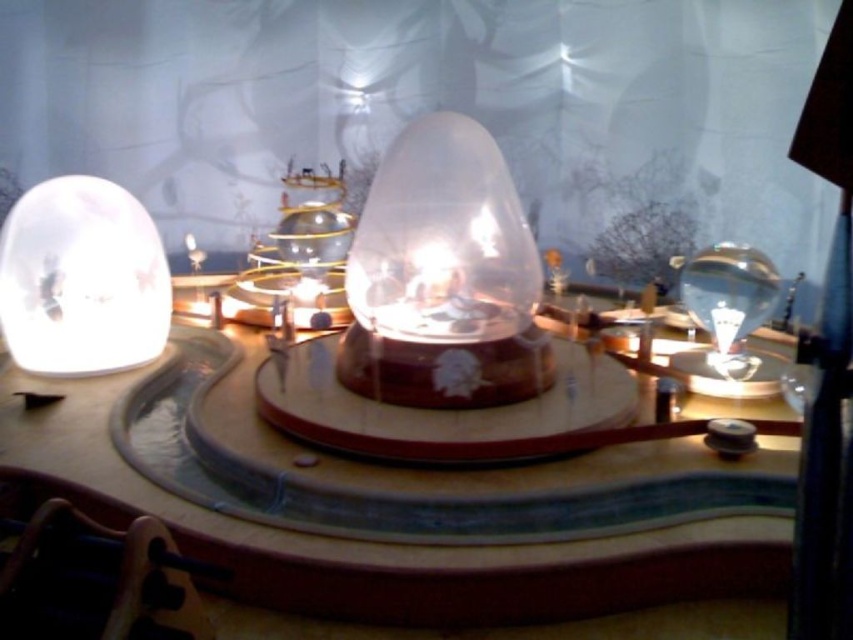
Question: Where is translucent glass globe at left located in relation to transparent glass lamp at right in the image?

Choices:
 (A) left
 (B) right

Answer: (A)

Question: Which point is closer to the camera?

Choices:
 (A) (155, 394)
 (B) (488, 241)
 (C) (688, 300)

Answer: (B)

Question: Can you confirm if transparent glass dome at center is positioned above translucent glass globe at left?

Choices:
 (A) yes
 (B) no

Answer: (A)

Question: Does translucent glass globe at left appear on the right side of transparent glass lamp at right?

Choices:
 (A) yes
 (B) no

Answer: (B)

Question: Among these points, which one is farthest from the camera?

Choices:
 (A) [113, 288]
 (B) [486, 288]
 (C) [730, 252]
 (D) [28, 410]

Answer: (C)

Question: Which of these objects is positioned closest to the translucent glass table at center?

Choices:
 (A) translucent glass globe at left
 (B) transparent glass lamp at right

Answer: (A)